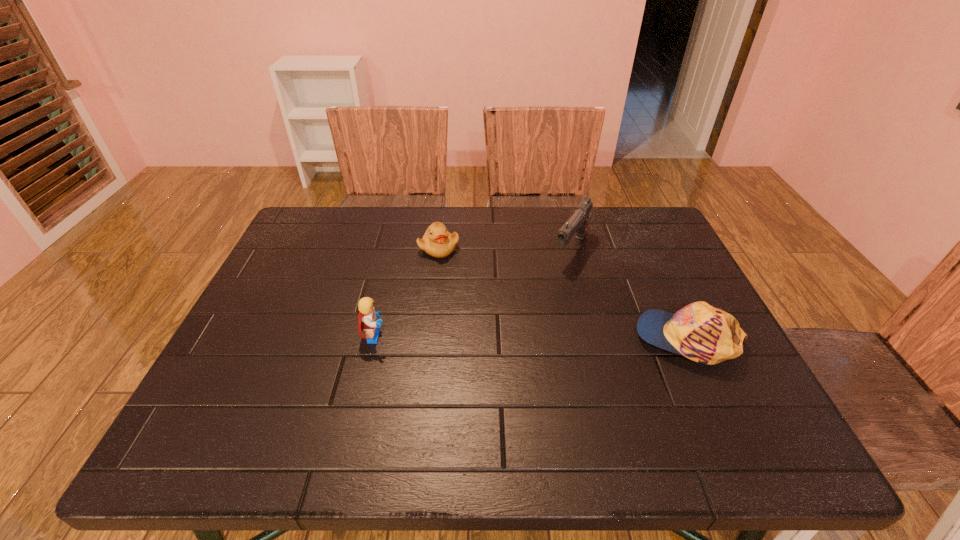
Identify the location of free space located in the direction the second object from right to left is aimed. Image resolution: width=960 pixels, height=540 pixels. (495, 366).

Where is `vacant space located 0.320m on the front-facing side of the duckling`? vacant space located 0.320m on the front-facing side of the duckling is located at coordinates (502, 335).

Image resolution: width=960 pixels, height=540 pixels. Find the location of `vacant space located 0.270m on the front-facing side of the duckling`. vacant space located 0.270m on the front-facing side of the duckling is located at coordinates (492, 321).

At what (x,y) coordinates should I click in order to perform the action: click on vacant space located 0.090m on the front-facing side of the duckling. Please return your answer as a coordinate pair (x, y). Looking at the image, I should click on (461, 278).

I want to click on gun situated at the far edge, so pos(578,222).

Locate an element on the screen. This screenshot has width=960, height=540. duckling located at the far edge is located at coordinates (437, 241).

The height and width of the screenshot is (540, 960). Identify the location of object at the right edge. (705, 334).

At what (x,y) coordinates should I click in order to perform the action: click on free space at the far edge of the desktop. Please return your answer as a coordinate pair (x, y). The height and width of the screenshot is (540, 960). Looking at the image, I should click on (356, 207).

At what (x,y) coordinates should I click in order to perform the action: click on free spot at the near edge of the desktop. Please return your answer as a coordinate pair (x, y). The width and height of the screenshot is (960, 540). Looking at the image, I should click on (387, 385).

In the image, there is a desktop. Where is `vacant space at the left edge`? This screenshot has height=540, width=960. vacant space at the left edge is located at coordinates (328, 265).